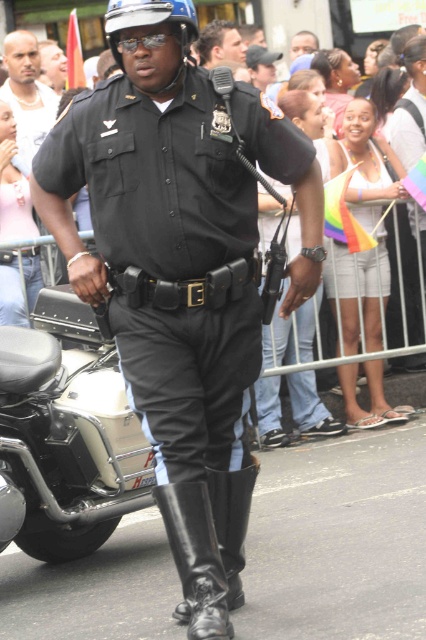
You are a photographer trying to capture a clear shot of both the matte black uniform at center and the black leather boot at center in the scene. Since you want to ensure both are fully visible in your photo, which object should you focus on first to frame the shot properly?

The matte black uniform at center is much taller than the black leather boot at center, so you should focus on framing the matte black uniform at center first to ensure it fits within the shot, then adjust to include the smaller black leather boot at center.

You are a photographer trying to capture a closeup shot of the police officer. You have a camera with a 10 cm wide lens. The officer is wearing a black leather boot at lower center and smooth skin at center. Which part of the officer can you focus on without the lens width being an issue?

The black leather boot at lower center has a width less than smooth skin at center, so focusing on the black leather boot at lower center would be better since it requires less width than the 10 cm lens allows.